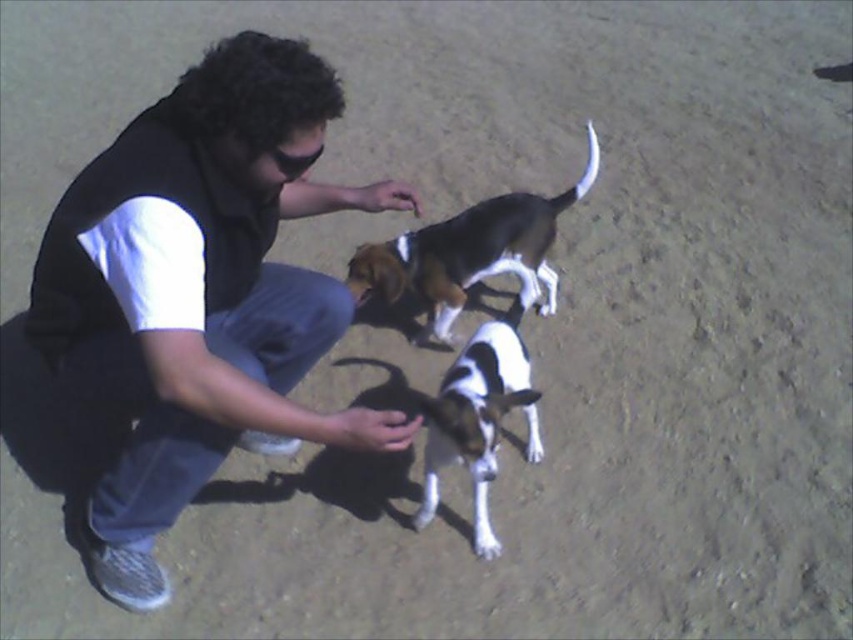
Does white and brown fur dog at center have a smaller size compared to white fur paw at lower center?

Incorrect, white and brown fur dog at center is not smaller in size than white fur paw at lower center.

Does point (495, 406) lie behind point (480, 531)?

No, it is in front of (480, 531).

Image resolution: width=853 pixels, height=640 pixels. I want to click on white and brown fur dog at center, so click(x=479, y=412).

Locate an element on the screen. The height and width of the screenshot is (640, 853). white and brown fur dog at center is located at coordinates (479, 412).

Measure the distance between black and white fur dog at center and camera.

black and white fur dog at center is 7.21 feet away from camera.

Is black and white fur dog at center smaller than white and brown fur dog at center?

Incorrect, black and white fur dog at center is not smaller in size than white and brown fur dog at center.

Which is in front, point (403, 252) or point (495, 417)?

Point (495, 417) is more forward.

Locate an element on the screen. This screenshot has height=640, width=853. black and white fur dog at center is located at coordinates (471, 253).

Does point (131, 593) come in front of point (549, 216)?

Yes, point (131, 593) is in front of point (549, 216).

Can you confirm if black matte shirt at center is positioned below black and white fur dog at center?

Indeed, black matte shirt at center is positioned under black and white fur dog at center.

Between point (257, 317) and point (488, 266), which one is positioned behind?

The point (488, 266) is more distant.

Where is `black matte shirt at center`? This screenshot has width=853, height=640. black matte shirt at center is located at coordinates (200, 291).